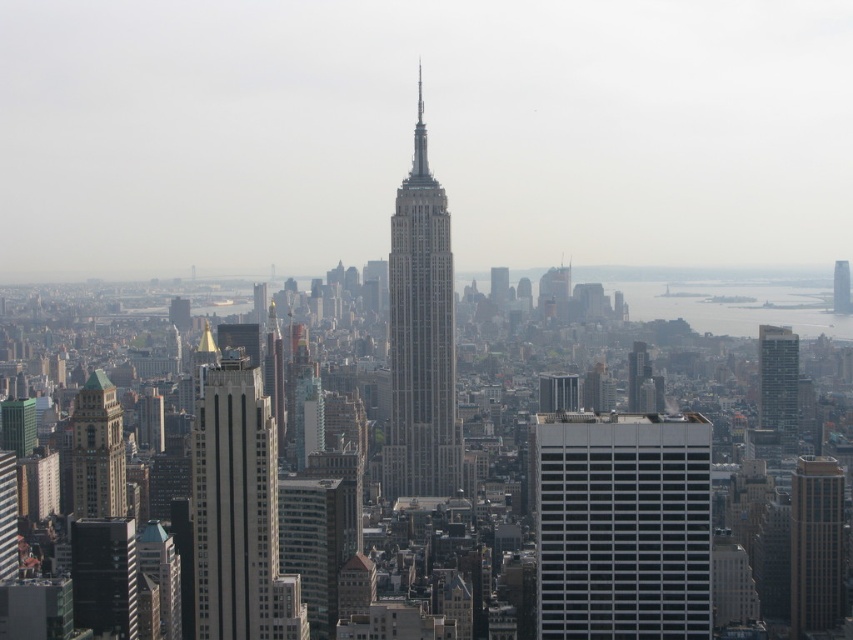
Can you confirm if gray concrete skyscraper at center-left is wider than white marble tower at center?

Correct, the width of gray concrete skyscraper at center-left exceeds that of white marble tower at center.

Does gray concrete skyscraper at center-left appear on the right side of white marble tower at center?

In fact, gray concrete skyscraper at center-left is to the left of white marble tower at center.

Does point (198, 493) come farther from viewer compared to point (405, 288)?

Yes.

The height and width of the screenshot is (640, 853). Find the location of `gray concrete skyscraper at center-left`. gray concrete skyscraper at center-left is located at coordinates (234, 504).

Which is in front, point (74, 488) or point (573, 378)?

Point (573, 378) is in front.

Identify the location of green marble tower at lower left. This screenshot has width=853, height=640. (97, 451).

Does point (437, 413) come in front of point (498, 285)?

Yes.

Is point (427, 419) more distant than point (491, 285)?

No, it is not.

Identify the location of white marble tower at center. [x=421, y=337].